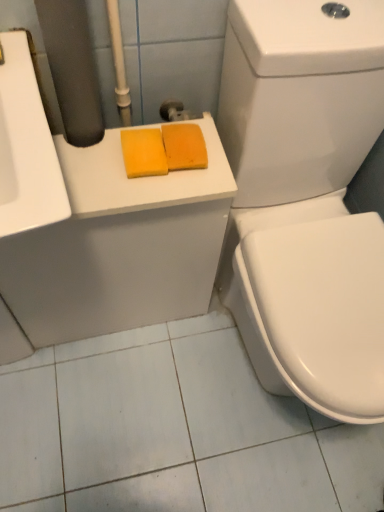
This screenshot has height=512, width=384. Identify the location of vacant space to the left of white glossy toilet at right. (133, 389).